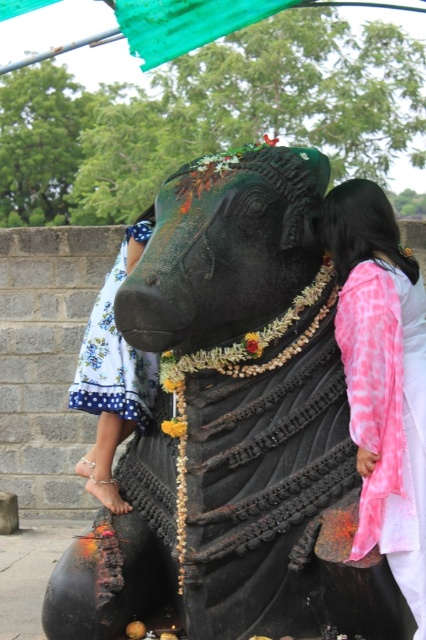
You are standing in front of the Nandi statue and want to place an offering. The statue is marked by the point at coordinates [233,426]. If you move 0.1 units to the right from this point, will you be closer to the statue or further away?

Moving 0.1 units to the right from the point at coordinates [233,426] would take you further away from the black stone statue at center, as the statue is located at that central point. Therefore, moving right increases the distance from the statue.

You are standing in front of the statue and want to place an offering exactly at the base of the black stone statue at center. According to the coordinates provided, where should you place the offering?

The offering should be placed at the base of the black stone statue at center, which is located at coordinates point (233, 426).